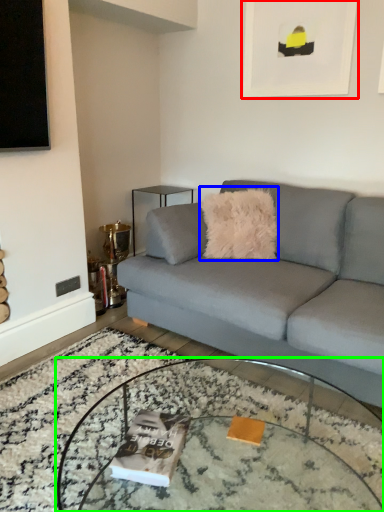
Question: Which is farther away from picture frame (highlighted by a red box)? throw pillow (highlighted by a blue box) or coffee table (highlighted by a green box)?

Choices:
 (A) throw pillow
 (B) coffee table

Answer: (B)